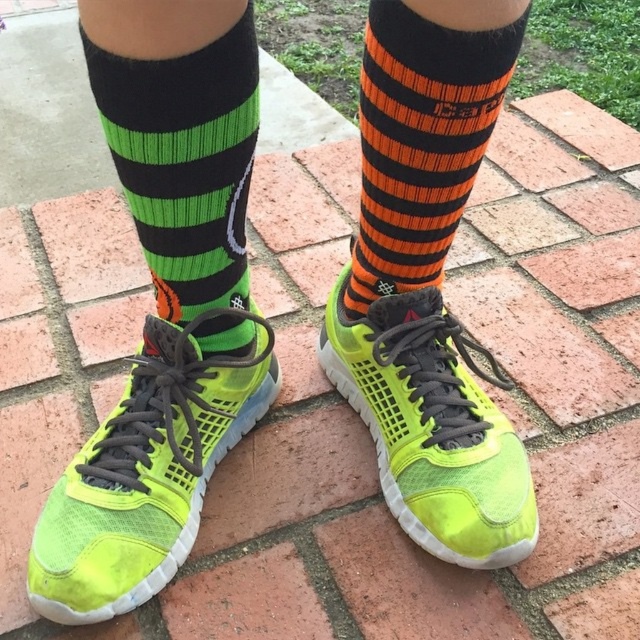
Is green knitted sock at left to the right of orange striped sock at upper right from the viewer's perspective?

No, green knitted sock at left is not to the right of orange striped sock at upper right.

Can you confirm if green knitted sock at left is positioned to the left of orange striped sock at upper right?

Correct, you'll find green knitted sock at left to the left of orange striped sock at upper right.

Between point (90, 42) and point (493, 28), which one is positioned in front?

Point (90, 42)

Find the location of `green knitted sock at left`. green knitted sock at left is located at coordinates (184, 161).

Between neon green mesh shoe at center and orange striped sock at upper right, which one has less height?

With less height is orange striped sock at upper right.

Consider the image. Is neon green mesh shoe at center shorter than orange striped sock at upper right?

Incorrect, neon green mesh shoe at center's height does not fall short of orange striped sock at upper right's.

I want to click on neon green mesh shoe at center, so click(433, 426).

Which of these two, green knitted sock at left or neon green mesh shoe at center, stands shorter?

green knitted sock at left is shorter.

Does green knitted sock at left appear on the right side of neon green mesh shoe at center?

Incorrect, green knitted sock at left is not on the right side of neon green mesh shoe at center.

The image size is (640, 640). I want to click on green knitted sock at left, so click(x=184, y=161).

Where is `green knitted sock at left`? The width and height of the screenshot is (640, 640). green knitted sock at left is located at coordinates (184, 161).